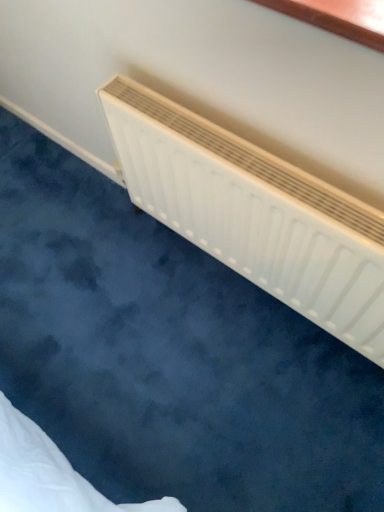
What is the approximate height of white matte radiator at upper center?

white matte radiator at upper center is 22.84 inches in height.

Image resolution: width=384 pixels, height=512 pixels. What do you see at coordinates (254, 213) in the screenshot?
I see `white matte radiator at upper center` at bounding box center [254, 213].

I want to click on white matte radiator at upper center, so click(x=254, y=213).

Measure the distance between white matte radiator at upper center and camera.

The depth of white matte radiator at upper center is 29.60 inches.

In order to click on white matte radiator at upper center in this screenshot , I will do `click(254, 213)`.